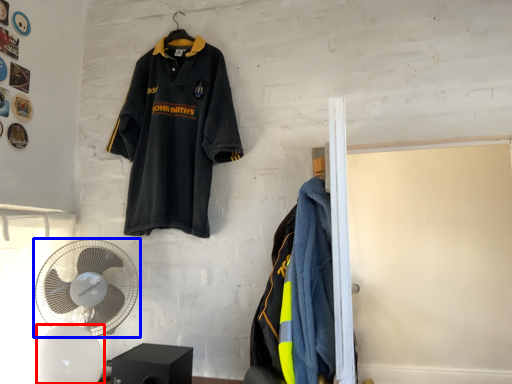
Question: Which of the following is the farthest to the observer, mechanical fan (highlighted by a red box) or mechanical fan (highlighted by a blue box)?

Choices:
 (A) mechanical fan
 (B) mechanical fan

Answer: (B)